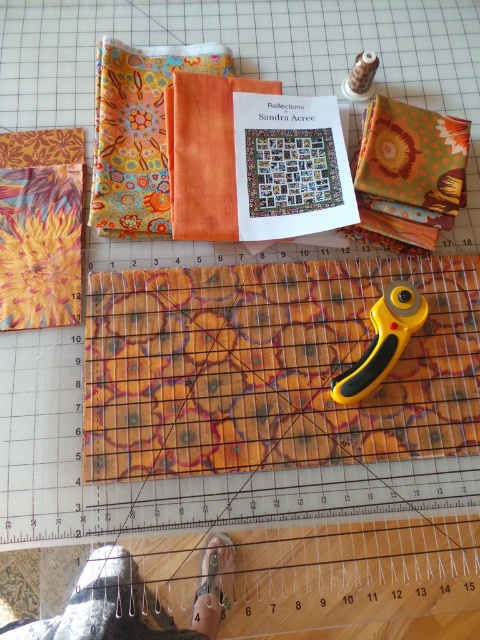
Which is below, orange cotton fabric at center or yellow plastic rotary cutter at center?

yellow plastic rotary cutter at center is below.

The image size is (480, 640). What do you see at coordinates (204, 154) in the screenshot?
I see `orange cotton fabric at center` at bounding box center [204, 154].

Between point (232, 141) and point (425, 301), which one is positioned in front?

Point (425, 301) is more forward.

The image size is (480, 640). In order to click on orange cotton fabric at center in this screenshot , I will do `click(204, 154)`.

Who is shorter, floral batik fabric at center or yellow plastic rotary cutter at center?

yellow plastic rotary cutter at center is shorter.

The width and height of the screenshot is (480, 640). What are the coordinates of `floral batik fabric at center` in the screenshot? It's located at (137, 132).

The height and width of the screenshot is (640, 480). In order to click on floral batik fabric at center in this screenshot , I will do `click(137, 132)`.

Consider the image. Is floral batik fabric at center bigger than orange cotton fabric at center?

Yes.

In the scene shown: Between floral batik fabric at center and orange cotton fabric at center, which one has more height?

floral batik fabric at center

Find the location of a particular element. This screenshot has height=640, width=480. floral batik fabric at center is located at coordinates (137, 132).